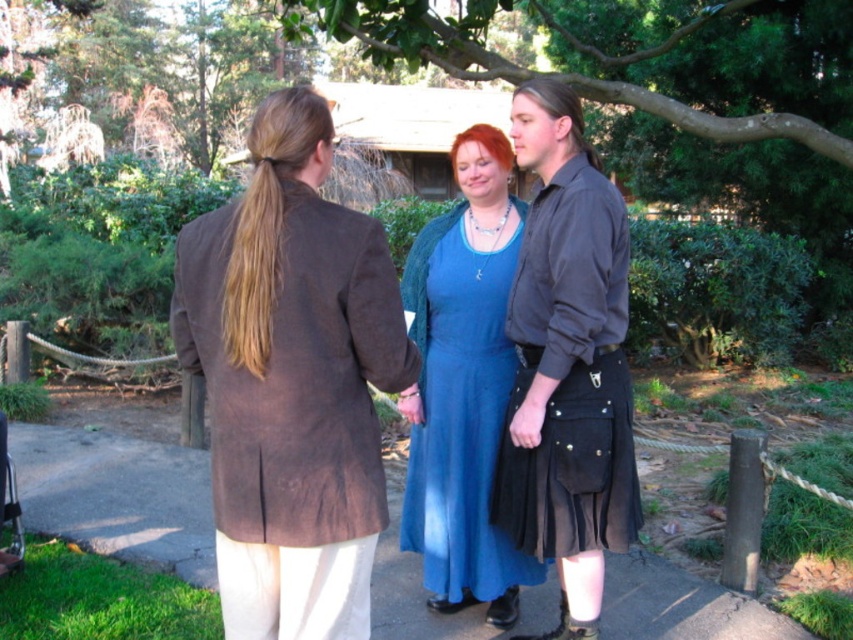
Question: Can you confirm if black leather kilt at center is smaller than matte blue dress at center?

Choices:
 (A) no
 (B) yes

Answer: (A)

Question: Which of the following is the closest to the observer?

Choices:
 (A) brown suede jacket at left
 (B) smooth concrete pavement at center

Answer: (A)

Question: Observing the image, what is the correct spatial positioning of black leather kilt at center in reference to matte blue dress at center?

Choices:
 (A) left
 (B) right

Answer: (B)

Question: Which point is closer to the camera?

Choices:
 (A) brown suede jacket at left
 (B) matte blue dress at center
 (C) smooth concrete pavement at center

Answer: (A)

Question: Is brown suede jacket at left to the left of black leather kilt at center from the viewer's perspective?

Choices:
 (A) yes
 (B) no

Answer: (A)

Question: Which of the following is the farthest from the observer?

Choices:
 (A) matte blue dress at center
 (B) brown suede jacket at left
 (C) black leather kilt at center

Answer: (A)